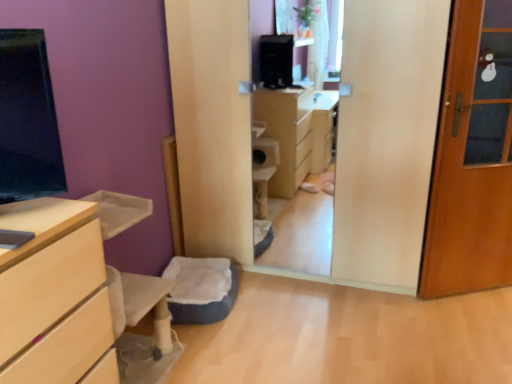
Question: In the image, is light wood chest of drawers at left positioned in front of or behind wooden door at right?

Choices:
 (A) behind
 (B) front

Answer: (B)

Question: In the image, is light wood chest of drawers at left on the left side or the right side of wooden door at right?

Choices:
 (A) left
 (B) right

Answer: (A)

Question: Estimate the real-world distances between objects in this image. Which object is closer to the soft gray cushion at lower center?

Choices:
 (A) wooden door at right
 (B) light wood chest of drawers at left

Answer: (B)

Question: Considering the real-world distances, which object is closest to the light wood chest of drawers at left?

Choices:
 (A) wooden door at right
 (B) soft gray cushion at lower center

Answer: (B)